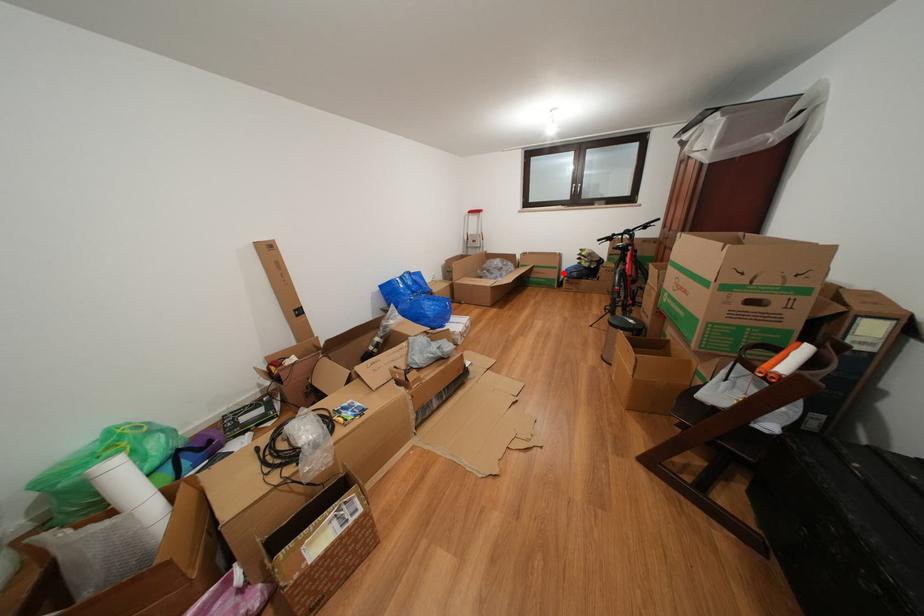
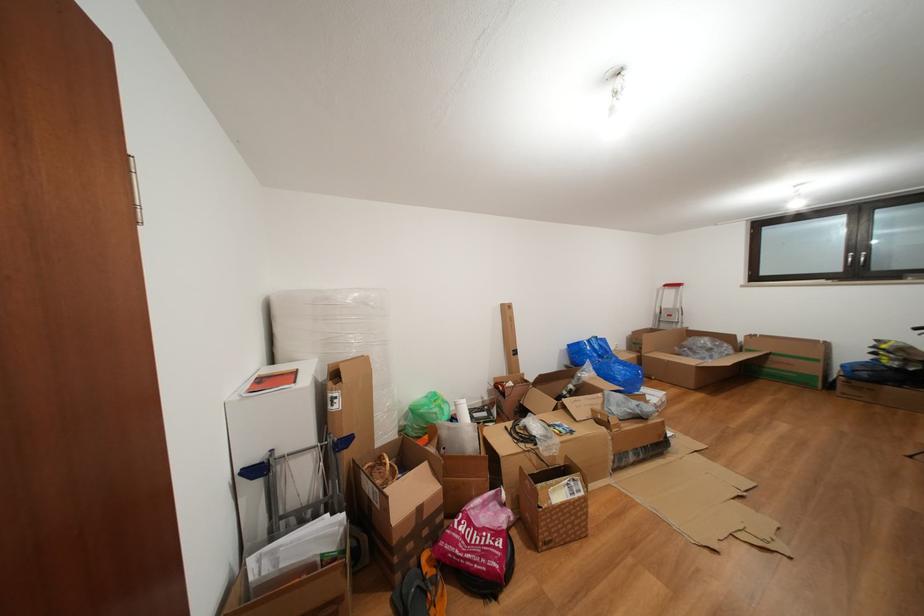
Locate, in the second image, the point that corresponds to the highlighted location in the first image.

(824, 366)